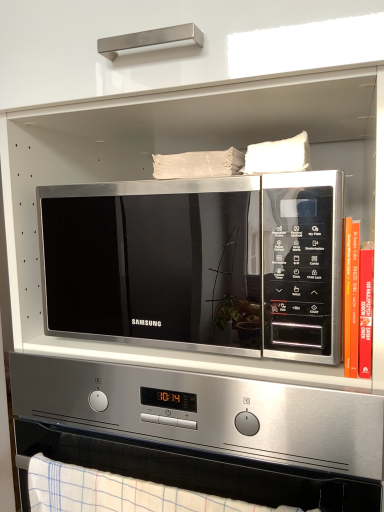
The image size is (384, 512). Find the location of `blank space to the left of hardcover book at right`. blank space to the left of hardcover book at right is located at coordinates (260, 375).